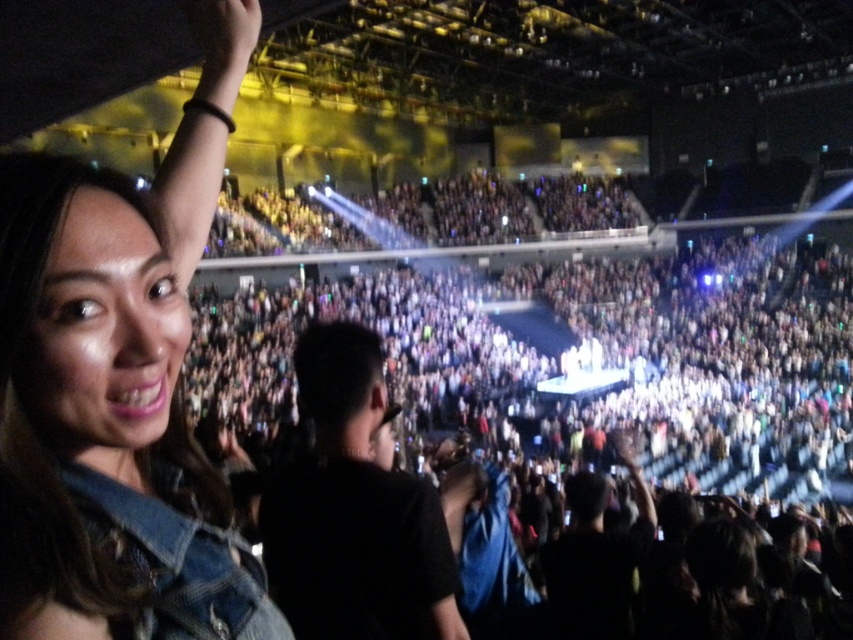
You are a photographer at the concert and need to adjust your camera focus. Which object, the denim jacket at upper left or the black matte shirt at center, should you focus on first if you want to capture the one that is closer to the camera?

The denim jacket at upper left is much taller than the black matte shirt at center, so it is closer to the camera. Therefore, you should focus on the denim jacket at upper left first.

You are a photographer at the concert and want to capture a photo of the denim jacket at upper left without the dark gray fabric crowd at center blocking it. Is this possible?

The dark gray fabric crowd at center is positioned over the denim jacket at upper left, so it will block the view of the denim jacket at upper left. You cannot capture a clear photo of the denim jacket at upper left without the crowd blocking it.

You are a photographer at the concert and want to capture both the denim jacket at upper left and the black matte shirt at center in a single frame. Which object should you position closer to the left side of your camera viewfinder to ensure both are included?

To include both the denim jacket at upper left and the black matte shirt at center in your frame, position the denim jacket at upper left closer to the left side of the camera viewfinder since it is already to the left of the black matte shirt at center.